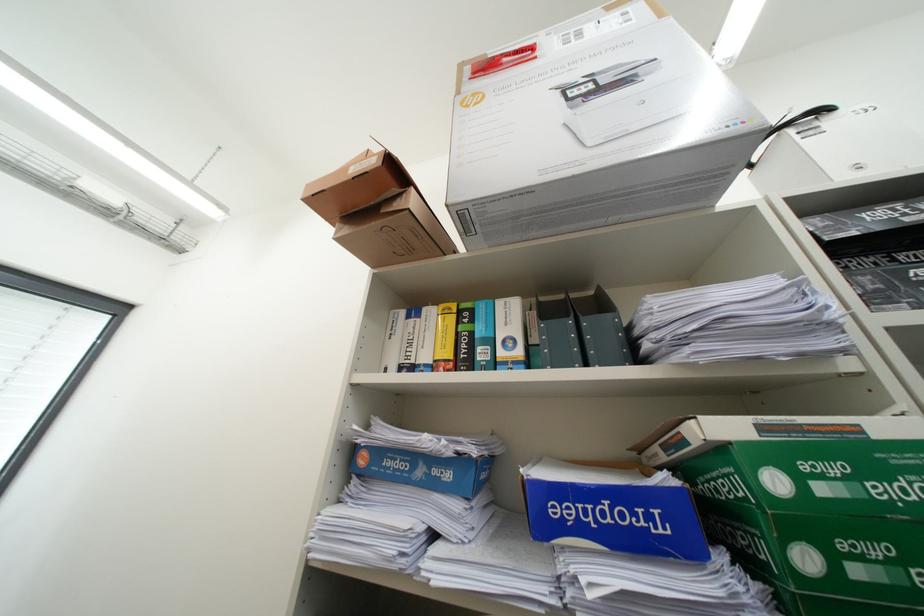
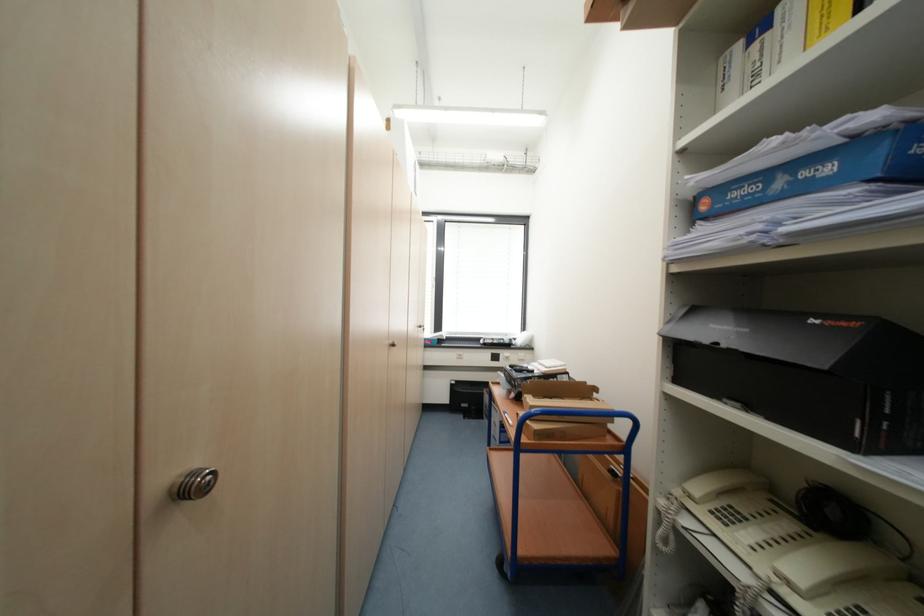
In the second image, find the point that corresponds to (x=441, y=472) in the first image.

(810, 176)